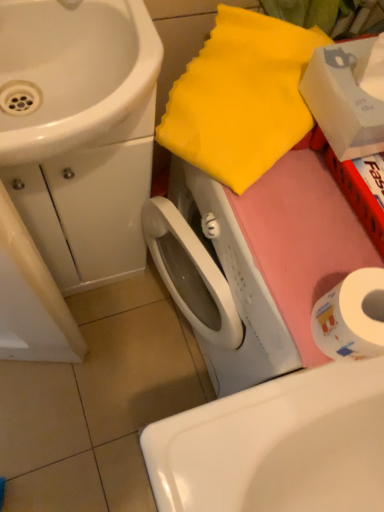
Identify the location of unoccupied space behind white paper at lower right. Image resolution: width=384 pixels, height=512 pixels. (319, 232).